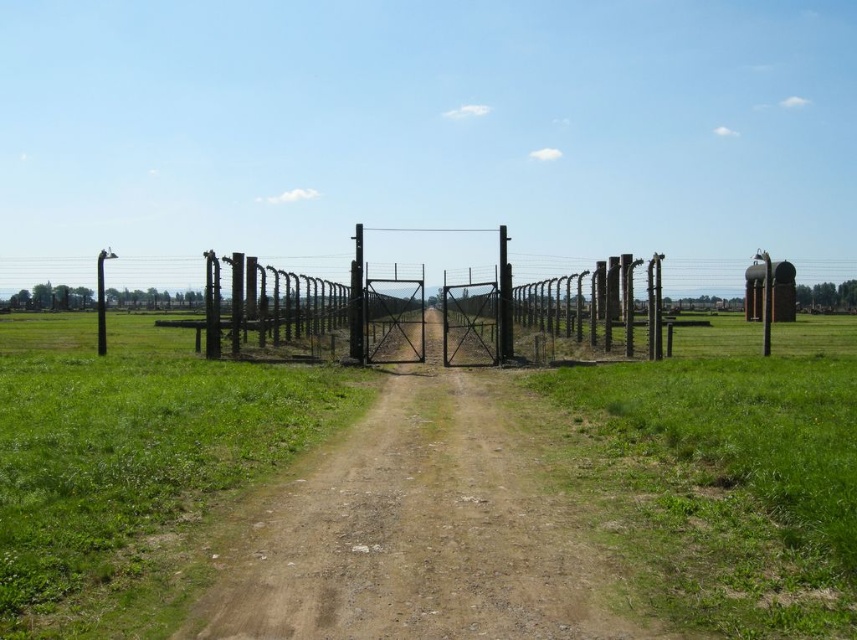
Question: Can you confirm if brown dirt track at center is positioned to the right of green grass at right?

Choices:
 (A) no
 (B) yes

Answer: (A)

Question: Which point appears closest to the camera in this image?

Choices:
 (A) (840, 484)
 (B) (502, 324)

Answer: (A)

Question: Which object is farther from the camera taking this photo?

Choices:
 (A) green grass at right
 (B) brown dirt track at center
 (C) black metal pole at center
 (D) black metal pole at left

Answer: (C)

Question: Based on their relative distances, which object is nearer to the black metal pole at left?

Choices:
 (A) green grass at right
 (B) brown dirt track at center

Answer: (B)

Question: Can you confirm if brown dirt track at center is smaller than green grass at right?

Choices:
 (A) no
 (B) yes

Answer: (B)

Question: From the image, what is the correct spatial relationship of brown dirt track at center in relation to black metal pole at center?

Choices:
 (A) right
 (B) left

Answer: (B)